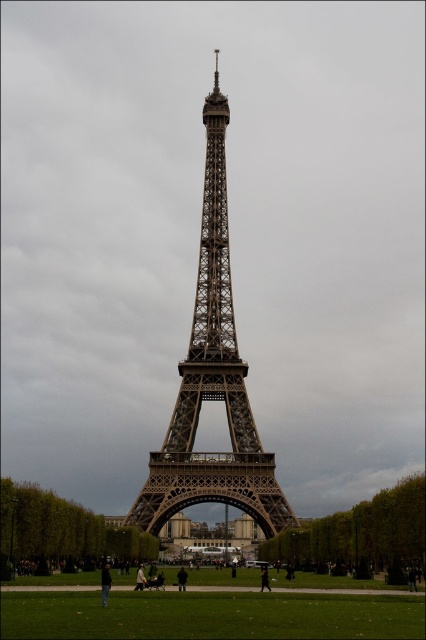
You are a tourist standing at the base of the Eiffel Tower. You notice the green grass at lower center and the dark gray fabric jacket at lower center. Which object is taller from your perspective?

The green grass at lower center is taller than the dark gray fabric jacket at lower center according to the description.

You are standing at the base of the Eiffel Tower and notice two points marked in the image. One is at coordinates point (221, 136) and the other at point (264, 580). If you were to walk towards the Eiffel Tower, which point would you encounter first?

Point (264, 580) is in front of point (221, 136), so you would encounter point (264, 580) first as you walk towards the Eiffel Tower.

You are a tourist visiting the Eiffel Tower. You see the green grass at lower center and the black fabric person at lower center. Which object is closer to the sky?

The green grass at lower center is located above the black fabric person at lower center, so the green grass at lower center is closer to the sky.